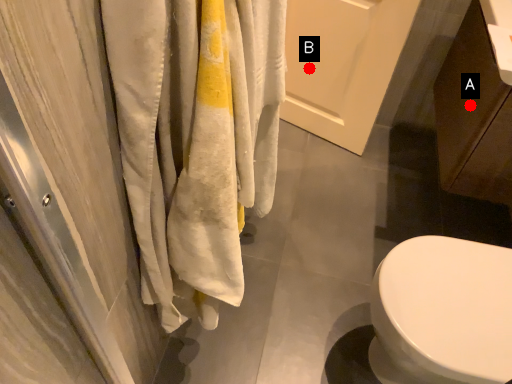
Question: Two points are circled on the image, labeled by A and B beside each circle. Which point is closer to the camera?

Choices:
 (A) A is closer
 (B) B is closer

Answer: (A)